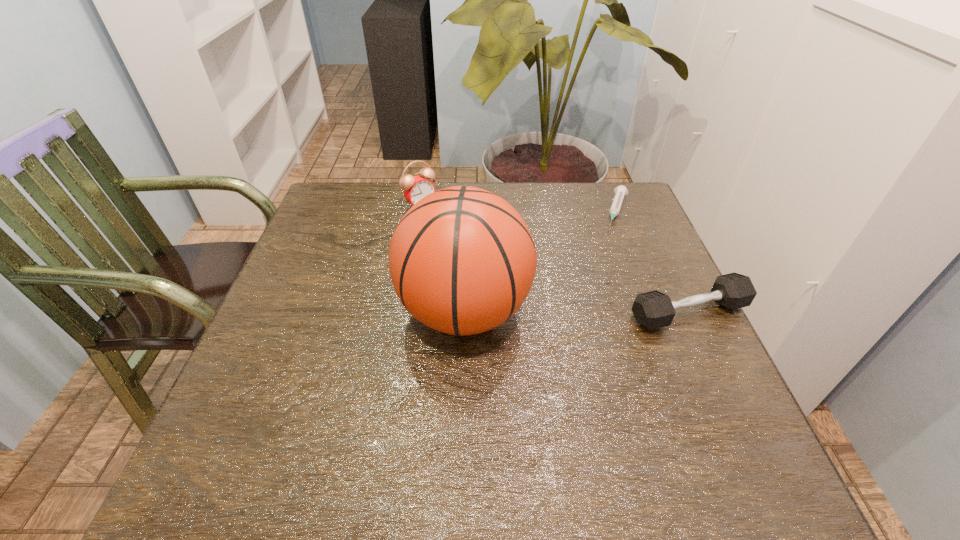
Locate which object is the third closest to the tallest object. Please provide its 2D coordinates. Your answer should be formatted as a tuple, i.e. [(x, y)], where the tuple contains the x and y coordinates of a point satisfying the conditions above.

[(620, 191)]

Identify which object is the closest to the syringe. Please provide its 2D coordinates. Your answer should be formatted as a tuple, i.e. [(x, y)], where the tuple contains the x and y coordinates of a point satisfying the conditions above.

[(654, 309)]

Image resolution: width=960 pixels, height=540 pixels. In order to click on vacant space that satisfies the following two spatial constraints: 1. on the front side of the alarm clock; 2. on the left side of the syringe in this screenshot , I will do (420, 211).